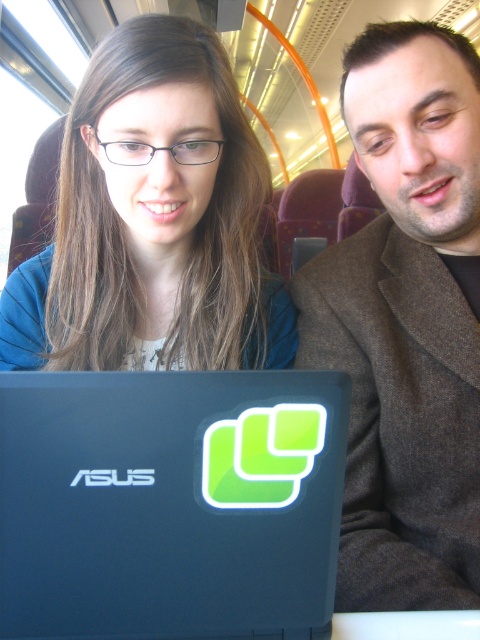
Question: Estimate the real-world distances between objects in this image. Which object is closer to the blue matte laptop at center?

Choices:
 (A) brown woolen jacket at right
 (B) matte blue shirt at upper left

Answer: (A)

Question: Among these objects, which one is farthest from the camera?

Choices:
 (A) brown woolen jacket at right
 (B) matte blue shirt at upper left

Answer: (B)

Question: Does blue matte laptop at center have a greater width compared to brown woolen jacket at right?

Choices:
 (A) no
 (B) yes

Answer: (B)

Question: Is the position of blue matte laptop at center less distant than that of matte blue shirt at upper left?

Choices:
 (A) yes
 (B) no

Answer: (A)

Question: Does brown woolen jacket at right have a smaller size compared to matte blue shirt at upper left?

Choices:
 (A) yes
 (B) no

Answer: (B)

Question: Among these points, which one is nearest to the camera?

Choices:
 (A) (436, 228)
 (B) (11, 300)

Answer: (A)